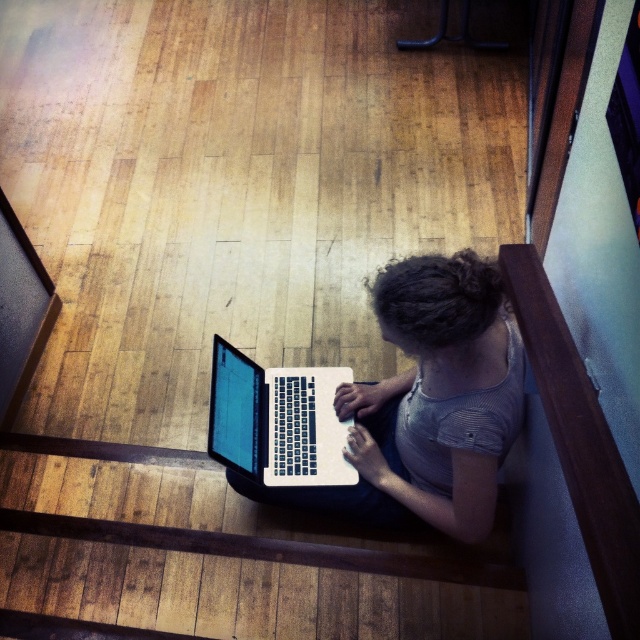
You are a person sitting on the wooden floor in the image. You need to place a small sticker exactly at point (428, 403). Where should you place it on the white matte laptop at center?

The point (428, 403) is located on the white matte laptop at center, so you should place the sticker there.

You are a delivery drone that needs to drop off a package to the white matte laptop at center. The delivery zone is a circle with radius 0.1 centered at point 0.5, 0.5. Will the package land within the delivery zone?

The white matte laptop at center is located at point (428,403). The distance between this point and the delivery zone center at (320,320) is sqrt of squared differences in x and y coordinates. Calculating the distance squared would be 0.131 squared plus 0.17 squared, which is 0.017161 plus 0.0289 equals 0.046061. The square root of that is approximately 0.2146. Since the radius is 0.1, the distance is larger than the radius, so the package will not land within the delivery zone.